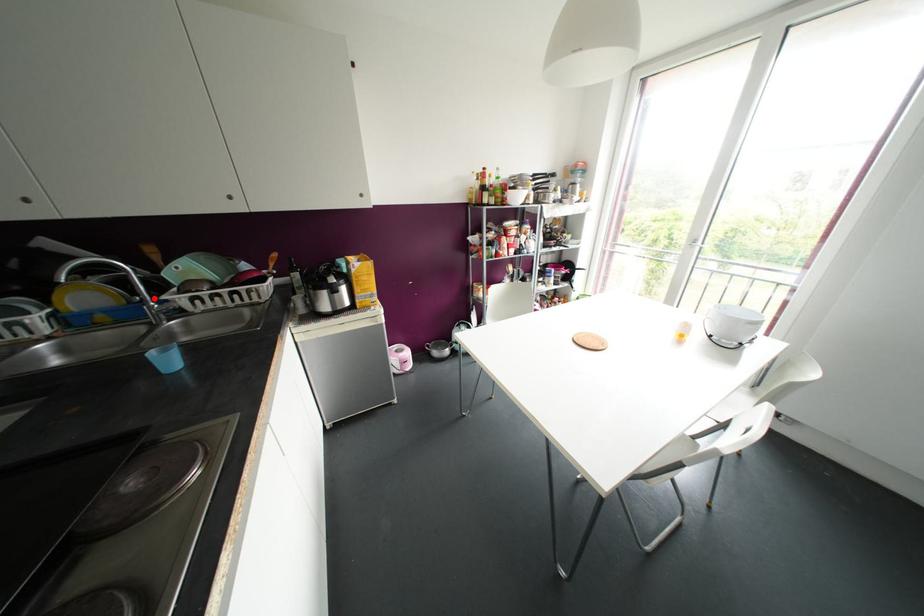
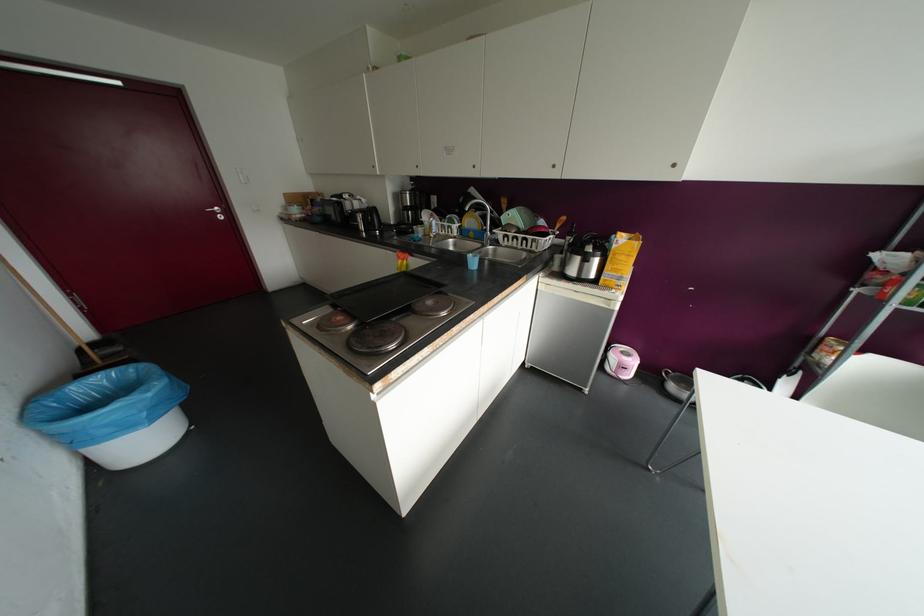
Locate, in the second image, the point that corresponds to the highlighted location in the first image.

(490, 230)